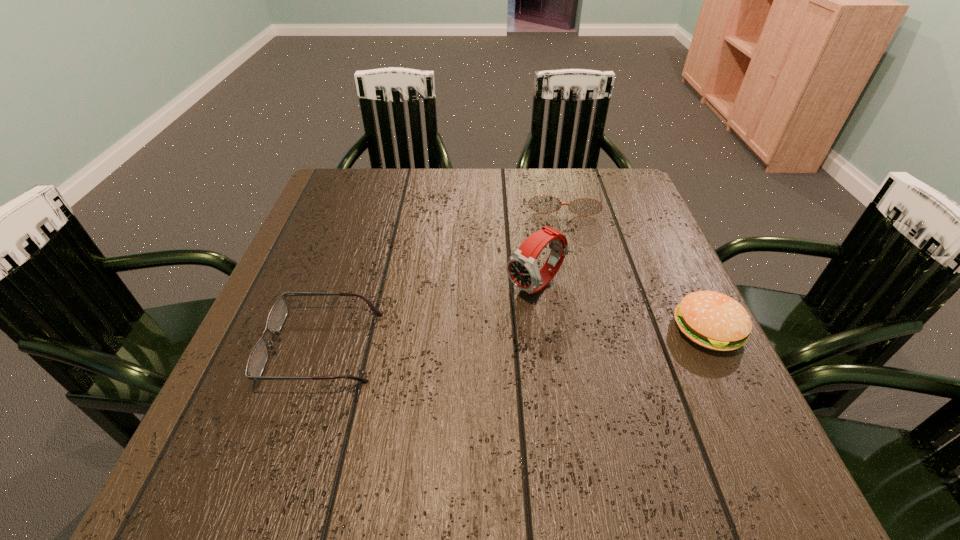
Image resolution: width=960 pixels, height=540 pixels. Identify the location of the leftmost object. (259, 355).

Locate an element on the screen. the second tallest object is located at coordinates (713, 320).

This screenshot has width=960, height=540. In order to click on the rightmost object in this screenshot , I will do `click(713, 320)`.

You are a GUI agent. You are given a task and a screenshot of the screen. Output one action in this format:
    pyautogui.click(x=<x>, y=<y>)
    Task: Click on the farthest object
    
    Given the screenshot: What is the action you would take?
    pyautogui.click(x=543, y=203)

The height and width of the screenshot is (540, 960). Identify the location of the tallest object. (522, 269).

Locate an element on the screen. vacant area situated on the left of the rightmost object is located at coordinates (623, 329).

The image size is (960, 540). Identify the location of blank space located on the face of the farthest object. (564, 279).

What are the coordinates of `blank area located 0.130m on the face of the farthest object` in the screenshot? It's located at (564, 248).

Find the location of a particular element. The width and height of the screenshot is (960, 540). vacant region located 0.340m on the face of the farthest object is located at coordinates (565, 311).

You are a GUI agent. You are given a task and a screenshot of the screen. Output one action in this format:
    pyautogui.click(x=<x>, y=<y>)
    Task: Click on the free location located 0.150m on the face of the watch
    
    Given the screenshot: What is the action you would take?
    pyautogui.click(x=463, y=340)